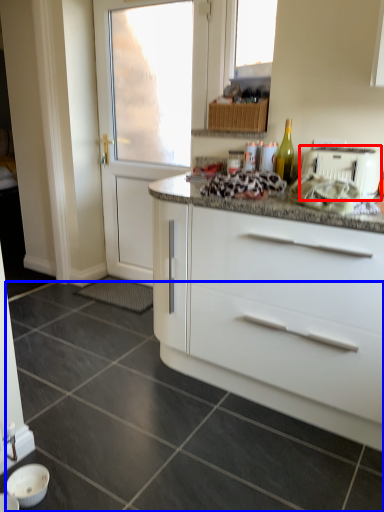
Question: Which object appears farthest to the camera in this image, toaster (highlighted by a red box) or granite (highlighted by a blue box)?

Choices:
 (A) toaster
 (B) granite

Answer: (A)